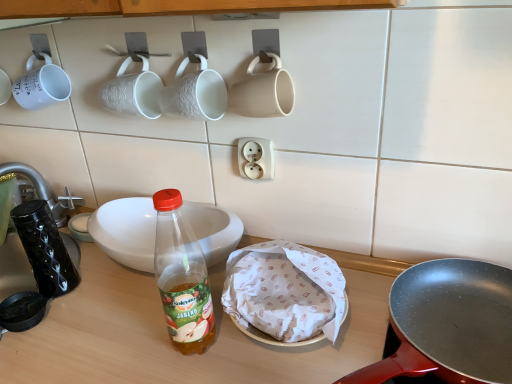
Find the location of a particular element. The height and width of the screenshot is (384, 512). vacant space that's between white ceramic bowl at center and translucent plastic bottle at center is located at coordinates (137, 313).